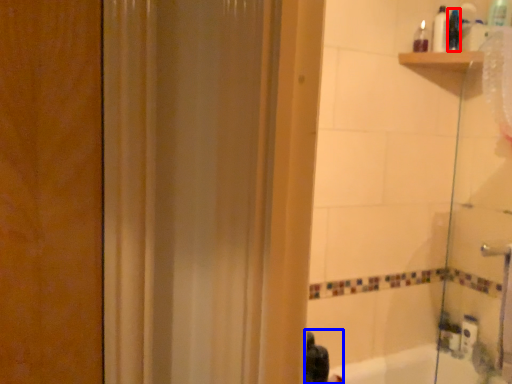
Question: Which of the following is the closest to the observer, toiletry (highlighted by a red box) or person (highlighted by a blue box)?

Choices:
 (A) toiletry
 (B) person

Answer: (B)